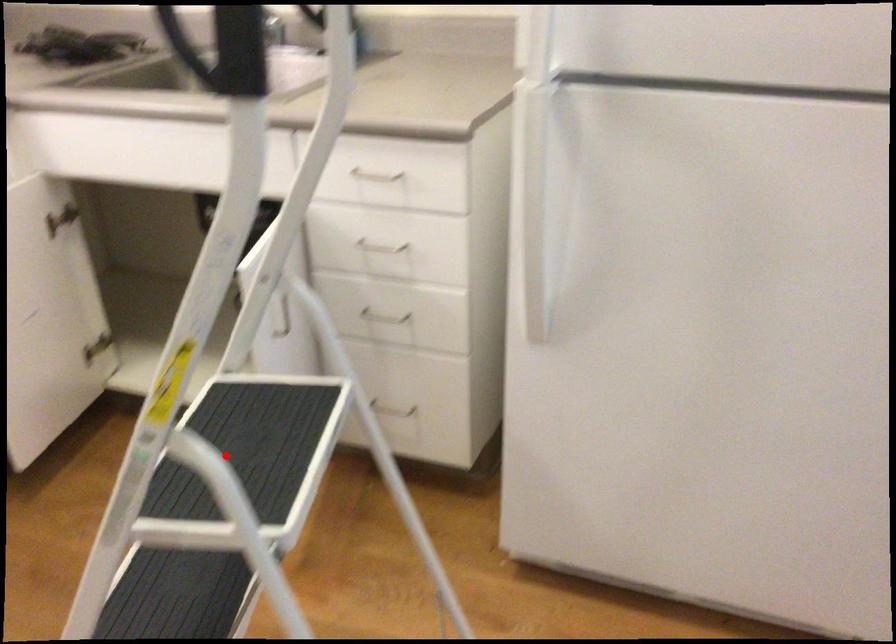
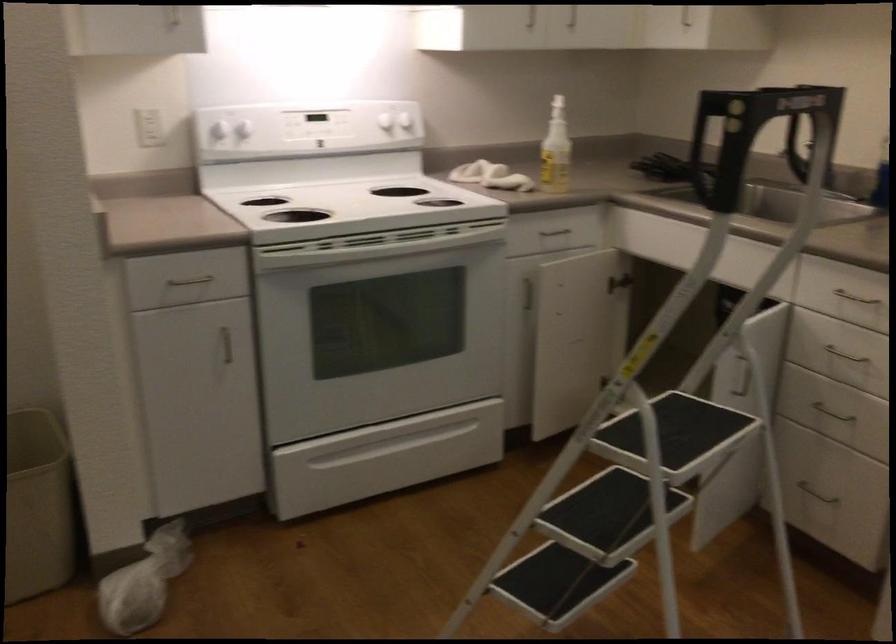
Find the pixel in the second image that matches the highlighted location in the first image.

(676, 429)